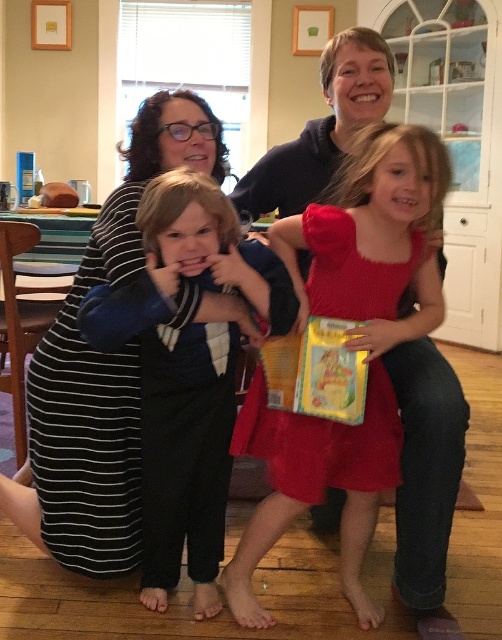
Is point (168, 460) farther from camera compared to point (331, 244)?

That is True.

Where is `blue cotton shirt at center`? The image size is (502, 640). blue cotton shirt at center is located at coordinates (187, 371).

In the scene shown: Does blue cotton shirt at center appear on the left side of striped fabric dress at left?

No, blue cotton shirt at center is not to the left of striped fabric dress at left.

Is point (211, 496) positioned before point (224, 314)?

That is False.

You are a GUI agent. You are given a task and a screenshot of the screen. Output one action in this format:
    pyautogui.click(x=<x>, y=<y>)
    Task: Click on the blue cotton shirt at center
    This screenshot has width=502, height=640.
    Given the screenshot: What is the action you would take?
    pyautogui.click(x=187, y=371)

Is striped fabric dress at left taller than red matte dress at center?

Yes, striped fabric dress at left is taller than red matte dress at center.

Is point (113, 504) positioned after point (288, 429)?

That is True.

This screenshot has width=502, height=640. What are the coordinates of `striped fabric dress at left` in the screenshot? It's located at (102, 369).

At what (x,y) coordinates should I click in order to perform the action: click on striped fabric dress at left. Please return your answer as a coordinate pair (x, y). The image size is (502, 640). Looking at the image, I should click on (102, 369).